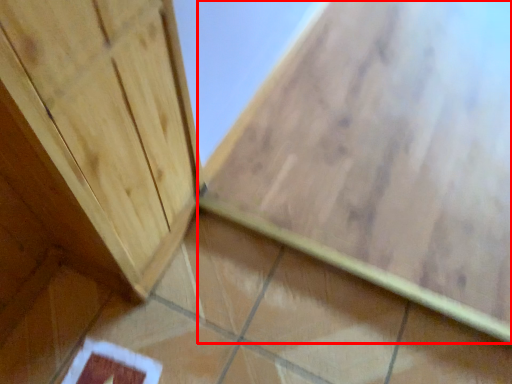
Question: In this image, where is ceramic tile (annotated by the red box) located relative to ceramic tile?

Choices:
 (A) left
 (B) right

Answer: (B)